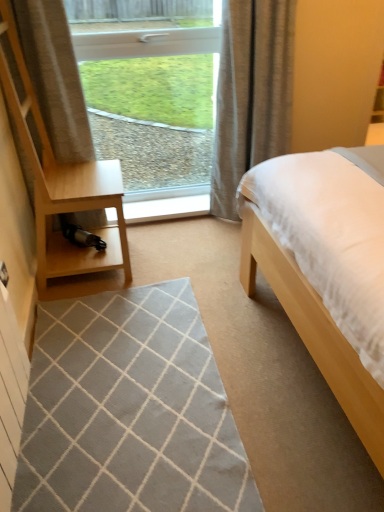
Question: Is gray woven mat at center positioned with its back to light wood/dark finish dresser at left?

Choices:
 (A) yes
 (B) no

Answer: (B)

Question: Considering the relative sizes of gray woven mat at center and light wood/dark finish dresser at left in the image provided, is gray woven mat at center smaller than light wood/dark finish dresser at left?

Choices:
 (A) yes
 (B) no

Answer: (A)

Question: From the image's perspective, does gray woven mat at center appear lower than light wood/dark finish dresser at left?

Choices:
 (A) yes
 (B) no

Answer: (A)

Question: From a real-world perspective, does gray woven mat at center stand above light wood/dark finish dresser at left?

Choices:
 (A) yes
 (B) no

Answer: (B)

Question: Does gray woven mat at center come in front of light wood/dark finish dresser at left?

Choices:
 (A) yes
 (B) no

Answer: (A)

Question: Does point (77, 185) appear closer or farther from the camera than point (243, 24)?

Choices:
 (A) closer
 (B) farther

Answer: (A)

Question: Looking at their shapes, would you say light wood/dark finish dresser at left is wider or thinner than gray textured curtain at upper right?

Choices:
 (A) thin
 (B) wide

Answer: (B)

Question: Visually, is light wood/dark finish dresser at left positioned to the left or to the right of gray textured curtain at upper right?

Choices:
 (A) left
 (B) right

Answer: (A)

Question: From a real-world perspective, is light wood/dark finish dresser at left above or below gray textured curtain at upper right?

Choices:
 (A) below
 (B) above

Answer: (B)

Question: Is point click(104, 381) positioned closer to the camera than point click(253, 45)?

Choices:
 (A) closer
 (B) farther

Answer: (A)

Question: From their relative heights in the image, would you say gray woven mat at center is taller or shorter than gray textured curtain at upper right?

Choices:
 (A) tall
 (B) short

Answer: (B)

Question: Would you say gray woven mat at center is to the left or to the right of gray textured curtain at upper right in the picture?

Choices:
 (A) left
 (B) right

Answer: (A)

Question: In the image, is gray woven mat at center positioned in front of or behind gray textured curtain at upper right?

Choices:
 (A) front
 (B) behind

Answer: (A)

Question: In terms of width, does gray woven mat at center look wider or thinner when compared to white plastic window at upper center?

Choices:
 (A) thin
 (B) wide

Answer: (B)

Question: In terms of height, does gray woven mat at center look taller or shorter compared to white plastic window at upper center?

Choices:
 (A) tall
 (B) short

Answer: (B)